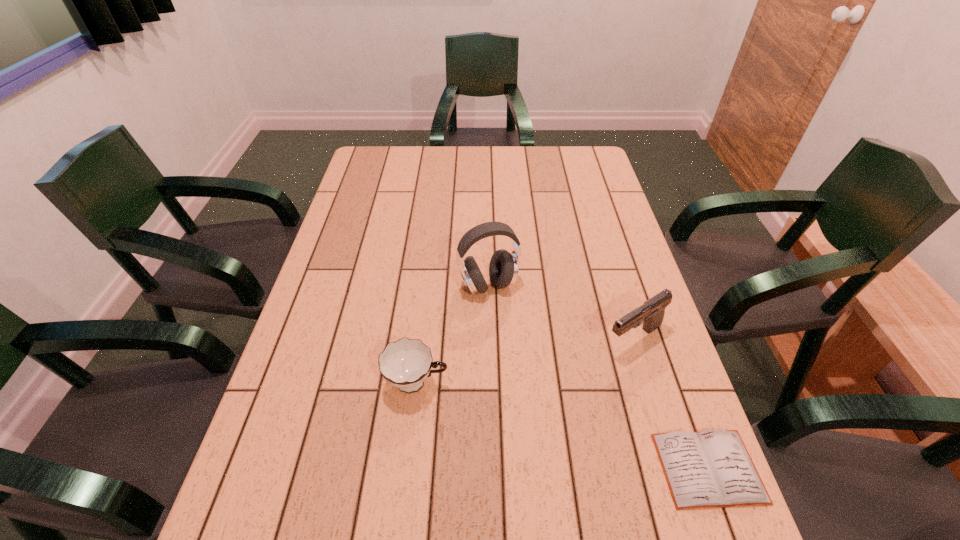
Locate an element on the screen. The width and height of the screenshot is (960, 540). vacant space at the far edge of the desktop is located at coordinates (478, 158).

The height and width of the screenshot is (540, 960). What are the coordinates of `vacant area at the left edge of the desktop` in the screenshot? It's located at (299, 335).

At what (x,y) coordinates should I click in order to perform the action: click on free space at the right edge of the desktop. Please return your answer as a coordinate pair (x, y). Looking at the image, I should click on (564, 189).

The width and height of the screenshot is (960, 540). I want to click on free location at the far left corner of the desktop, so click(x=380, y=164).

This screenshot has width=960, height=540. What are the coordinates of `vacant area at the near left corner of the desktop` in the screenshot? It's located at (275, 471).

Identify the location of vacant area at the far right corner. The width and height of the screenshot is (960, 540). (582, 166).

This screenshot has width=960, height=540. I want to click on unoccupied area between the third shortest object and the tallest object, so click(x=561, y=313).

Where is `free point between the second object from left to right and the pistol`? free point between the second object from left to right and the pistol is located at coordinates (561, 313).

Where is `free area in between the nearest object and the cup`? free area in between the nearest object and the cup is located at coordinates (563, 426).

This screenshot has height=540, width=960. Find the location of `free spot between the headset and the shortest object`. free spot between the headset and the shortest object is located at coordinates (598, 377).